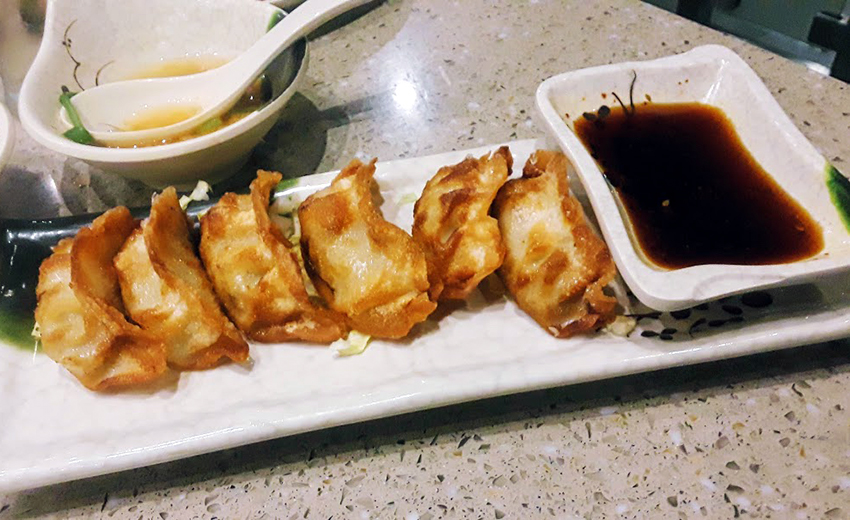
At what (x,y) coordinates should I click in order to perform the action: click on spoon. Please return your answer as a coordinate pair (x, y). This screenshot has height=520, width=850. Looking at the image, I should click on (255, 66).